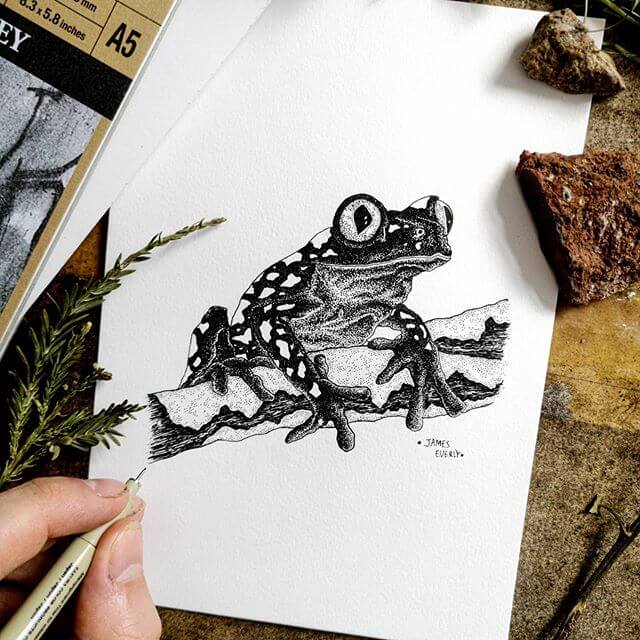
Locate an element on the screen. This screenshot has width=640, height=640. pencil box is located at coordinates (68, 74).